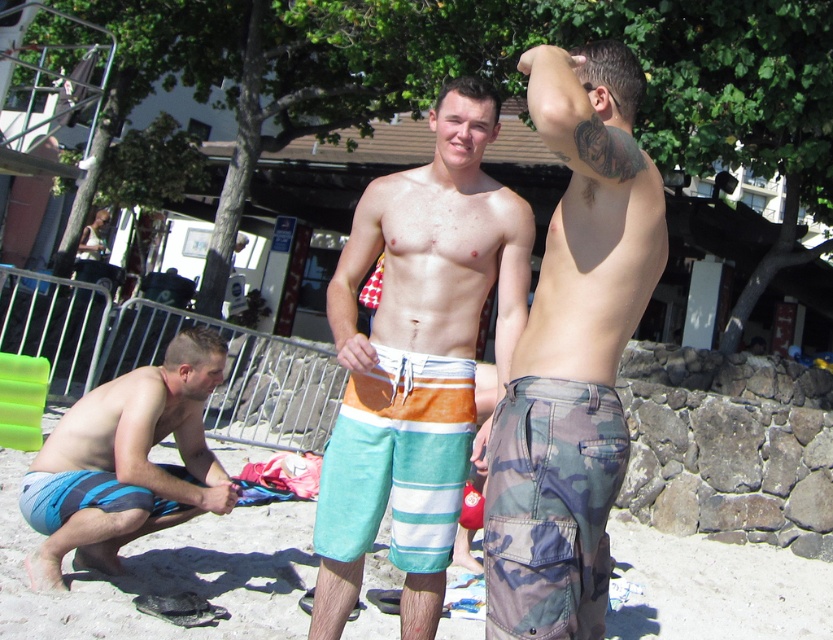
Which of these two, multicolored striped boardshorts at center or blue striped boardshorts at lower left, stands shorter?

blue striped boardshorts at lower left

Does multicolored striped boardshorts at center have a larger size compared to blue striped boardshorts at lower left?

Indeed, multicolored striped boardshorts at center has a larger size compared to blue striped boardshorts at lower left.

Is point (437, 531) more distant than point (92, 404)?

That is False.

The width and height of the screenshot is (833, 640). I want to click on multicolored striped boardshorts at center, so click(x=416, y=358).

Between camo fabric shorts at right and blue striped boardshorts at lower left, which one appears on the left side from the viewer's perspective?

blue striped boardshorts at lower left is more to the left.

Who is more forward, (602, 140) or (153, 442)?

Positioned in front is point (602, 140).

Identify the location of camo fabric shorts at right. This screenshot has width=833, height=640. tap(572, 353).

Can you confirm if camo fabric shorts at right is smaller than striped cotton boardshorts at center?

No.

Which is in front, point (620, 465) or point (408, 484)?

Positioned in front is point (620, 465).

At what (x,y) coordinates should I click in order to perform the action: click on camo fabric shorts at right. Please return your answer as a coordinate pair (x, y). This screenshot has height=640, width=833. Looking at the image, I should click on (572, 353).